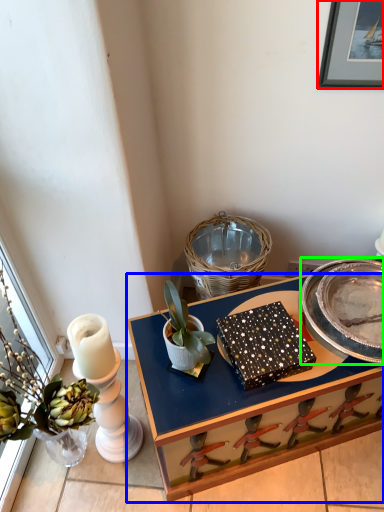
Question: Which is nearer to the picture frame (highlighted by a red box)? desk (highlighted by a blue box) or plate (highlighted by a green box).

Choices:
 (A) desk
 (B) plate

Answer: (B)